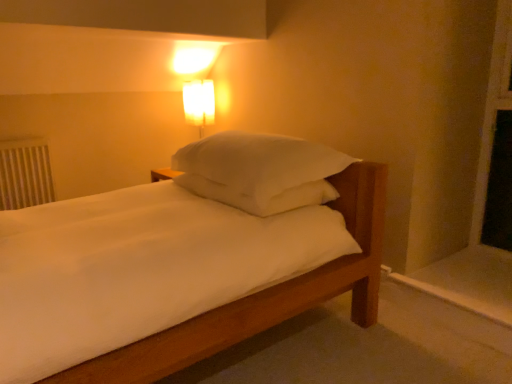
Question: Are matte glass lampshade at upper center and wooden bed frame at lower center far apart?

Choices:
 (A) no
 (B) yes

Answer: (B)

Question: Can you confirm if matte glass lampshade at upper center is shorter than wooden bed frame at lower center?

Choices:
 (A) yes
 (B) no

Answer: (B)

Question: Is matte glass lampshade at upper center looking in the opposite direction of wooden bed frame at lower center?

Choices:
 (A) yes
 (B) no

Answer: (B)

Question: Is matte glass lampshade at upper center at the left side of wooden bed frame at lower center?

Choices:
 (A) yes
 (B) no

Answer: (A)

Question: Is matte glass lampshade at upper center oriented towards wooden bed frame at lower center?

Choices:
 (A) no
 (B) yes

Answer: (A)

Question: Does matte glass lampshade at upper center have a lesser width compared to wooden bed frame at lower center?

Choices:
 (A) no
 (B) yes

Answer: (B)

Question: From the image's perspective, is white painted wood at lower right below wooden bed frame at lower center?

Choices:
 (A) no
 (B) yes

Answer: (A)

Question: Is white painted wood at lower right not close to wooden bed frame at lower center?

Choices:
 (A) yes
 (B) no

Answer: (B)

Question: Is white painted wood at lower right further to camera compared to wooden bed frame at lower center?

Choices:
 (A) yes
 (B) no

Answer: (A)

Question: Is white painted wood at lower right taller than wooden bed frame at lower center?

Choices:
 (A) yes
 (B) no

Answer: (B)

Question: Can we say white painted wood at lower right lies outside wooden bed frame at lower center?

Choices:
 (A) yes
 (B) no

Answer: (A)

Question: Considering the relative positions of white painted wood at lower right and wooden bed frame at lower center in the image provided, is white painted wood at lower right to the right of wooden bed frame at lower center from the viewer's perspective?

Choices:
 (A) no
 (B) yes

Answer: (B)

Question: Does white plastic radiator at left lie behind white soft pillow at center?

Choices:
 (A) no
 (B) yes

Answer: (B)